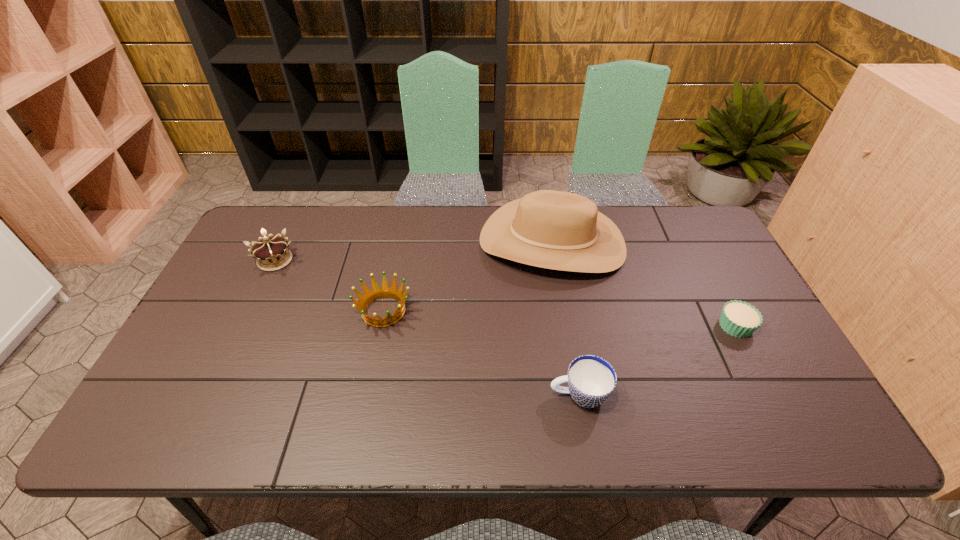
Locate an element on the screen. free space between the nearer crown and the leftmost object is located at coordinates (329, 286).

The image size is (960, 540). Find the location of `vacant space in between the nearer crown and the nearest object`. vacant space in between the nearer crown and the nearest object is located at coordinates (481, 353).

You are a GUI agent. You are given a task and a screenshot of the screen. Output one action in this format:
    pyautogui.click(x=<x>, y=<y>)
    Task: Click on the unoccupied position between the cowboy hat and the left crown
    This screenshot has height=540, width=960.
    Given the screenshot: What is the action you would take?
    pyautogui.click(x=414, y=251)

I want to click on free spot between the shortest object and the leftmost object, so click(x=505, y=293).

At what (x,y) coordinates should I click in order to perform the action: click on free space that is in between the tallest object and the left crown. Please return your answer as a coordinate pair (x, y). Looking at the image, I should click on (414, 251).

This screenshot has width=960, height=540. In order to click on vacant space in between the second object from left to right and the left crown in this screenshot , I will do `click(329, 286)`.

This screenshot has width=960, height=540. I want to click on free space that is in between the left crown and the nearest object, so click(427, 328).

In order to click on the closest object to the cup in this screenshot , I will do `click(551, 229)`.

Locate which object ranks third in proximity to the cupcake. Please provide its 2D coordinates. Your answer should be formatted as a tuple, i.e. [(x, y)], where the tuple contains the x and y coordinates of a point satisfying the conditions above.

[(384, 292)]

The width and height of the screenshot is (960, 540). Find the location of `free spot that satisfies the following two spatial constraints: 1. on the back side of the cowboy hat; 2. on the right side of the leftmost object`. free spot that satisfies the following two spatial constraints: 1. on the back side of the cowboy hat; 2. on the right side of the leftmost object is located at coordinates (284, 242).